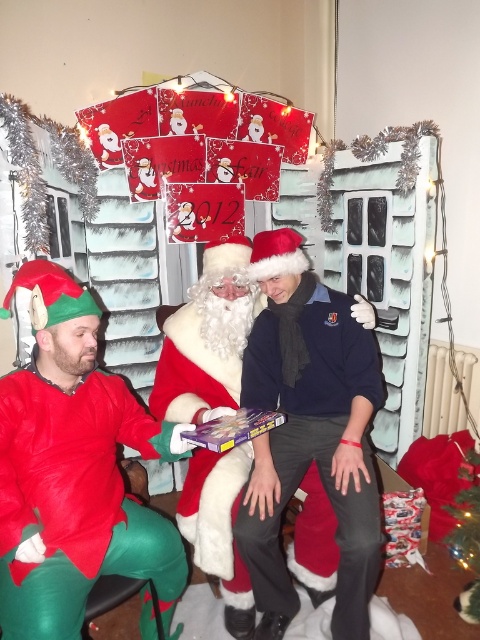
You are a photographer trying to capture a group photo of the dark blue sweater at center and the matte red santa suit at center. Since you want to ensure both subjects are visible, which one should you position to the left to maintain their current spatial relationship?

To maintain their current spatial relationship where the dark blue sweater at center is on the right side of the matte red santa suit at center, you should position the matte red santa suit at center to the left so that the dark blue sweater at center remains to its right.

You are a photographer trying to capture a group photo of the people in the scene. You want to ensure that both the dark blue sweater at center and the matte red santa suit at center are fully visible in the frame. Considering their heights, which one might require you to adjust your camera angle to avoid cropping?

The dark blue sweater at center is shorter than the matte red santa suit at center. Therefore, to ensure both are fully visible, you might need to lower the camera angle slightly to accommodate the taller matte red santa suit at center, ensuring it doesn